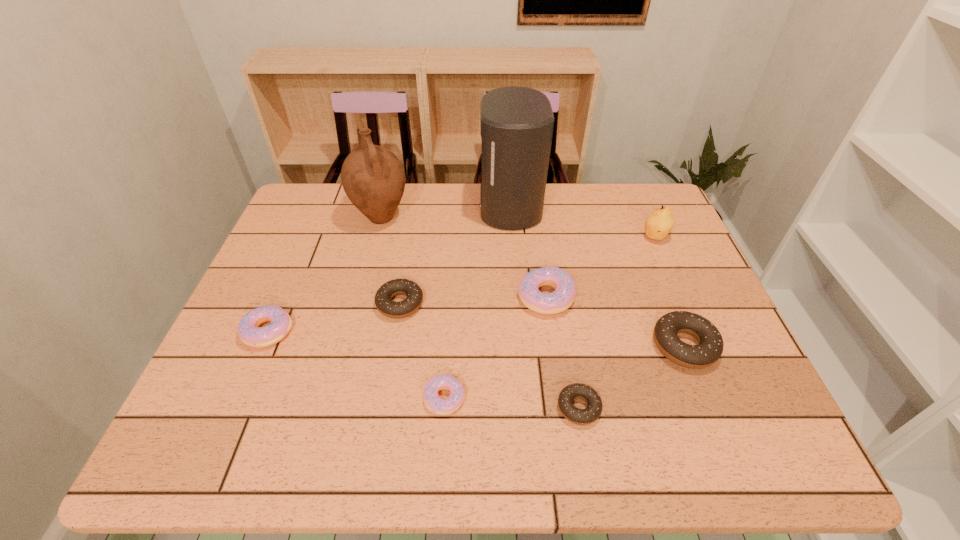
Where is `the fifth doughnut from right to left`? the fifth doughnut from right to left is located at coordinates click(x=384, y=304).

What are the coordinates of `the nearest pink doughnut` in the screenshot? It's located at (437, 405).

At what (x,y) coordinates should I click in order to perform the action: click on the third doughnut from left to right. Please return your answer as a coordinate pair (x, y). Looking at the image, I should click on (437, 405).

The height and width of the screenshot is (540, 960). What are the coordinates of `the second brown doughnut from left to right` in the screenshot? It's located at (591, 413).

Locate an element on the screen. This screenshot has width=960, height=540. the smallest brown doughnut is located at coordinates (591, 413).

Where is `free space located 0.260m on the button side of the coffee maker`? The width and height of the screenshot is (960, 540). free space located 0.260m on the button side of the coffee maker is located at coordinates (398, 206).

The image size is (960, 540). I want to click on vacant position located 0.360m on the button side of the coffee maker, so click(367, 206).

Where is `blank area located 0.150m on the button side of the coffee maker`? The image size is (960, 540). blank area located 0.150m on the button side of the coffee maker is located at coordinates (432, 206).

Locate an element on the screen. Image resolution: width=960 pixels, height=540 pixels. vacant space located 0.340m on the front of the eighth shortest object is located at coordinates (353, 325).

The image size is (960, 540). I want to click on free region located on the front of the pear, so click(692, 323).